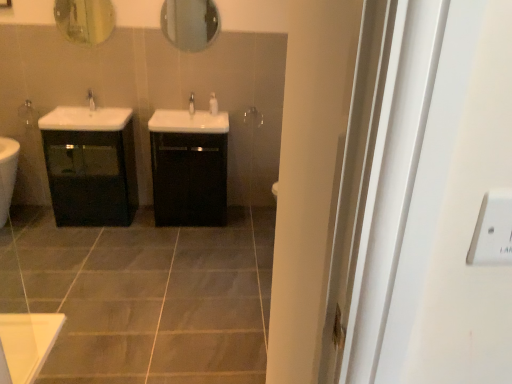
In order to click on unoccupied region to the right of black glossy cabinet at center, arranged as the 1th bathroom cabinet when viewed from the right in this screenshot , I will do `click(243, 225)`.